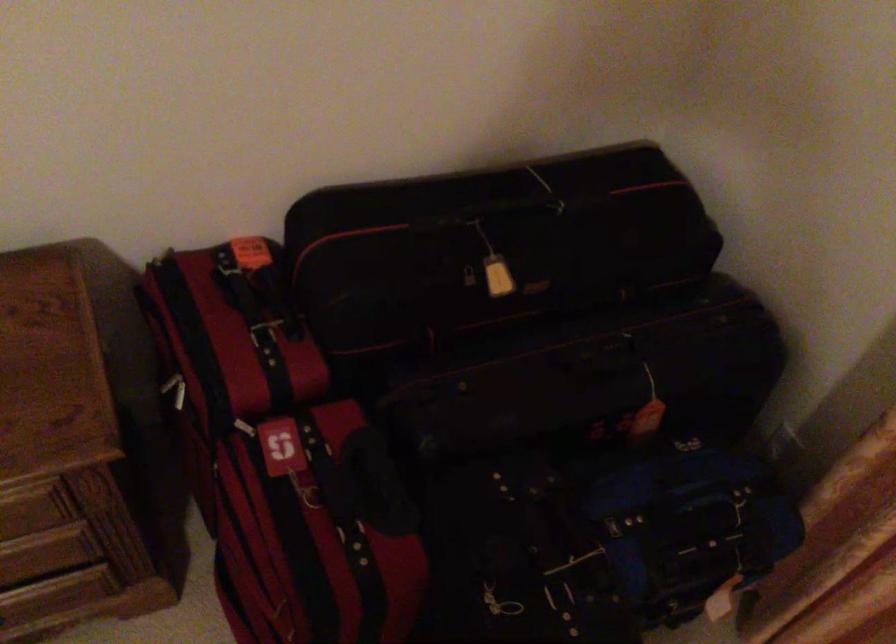
The width and height of the screenshot is (896, 644). I want to click on black buckle, so click(x=264, y=334).